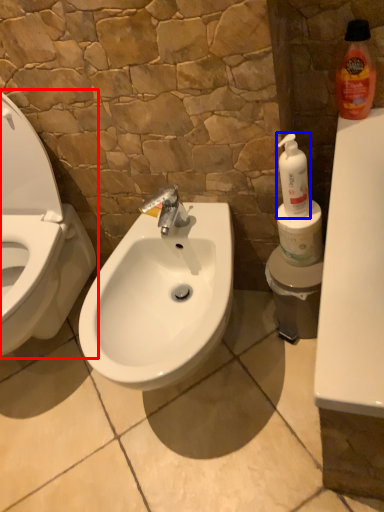
Question: Among these objects, which one is farthest to the camera, toilet (highlighted by a red box) or cleaning product (highlighted by a blue box)?

Choices:
 (A) toilet
 (B) cleaning product

Answer: (B)